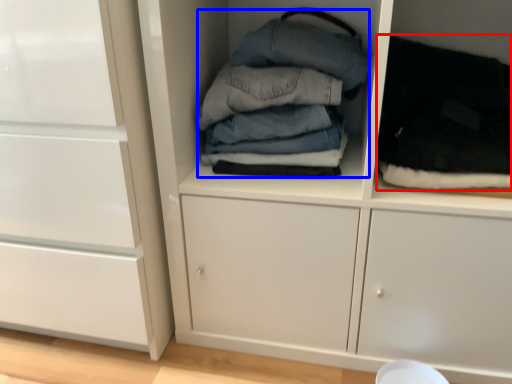
Question: Which object appears farthest to the camera in this image, clothing (highlighted by a red box) or clothing (highlighted by a blue box)?

Choices:
 (A) clothing
 (B) clothing

Answer: (B)